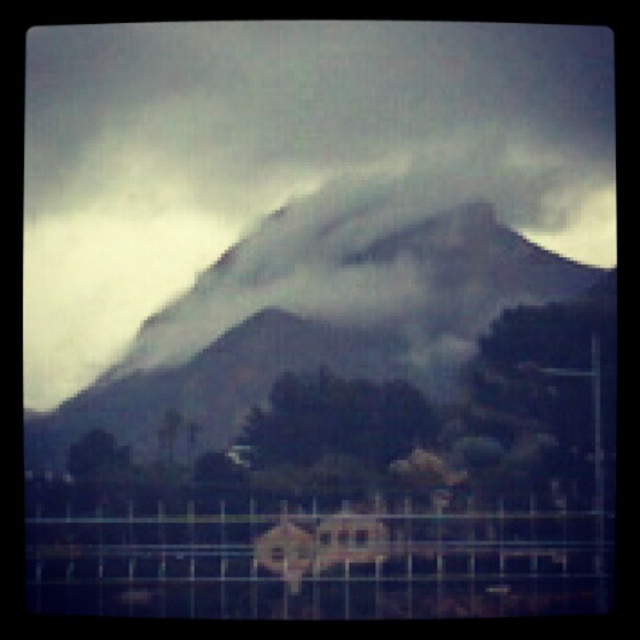
Question: Which point is closer to the camera?

Choices:
 (A) (120, 509)
 (B) (381, 300)

Answer: (A)

Question: Is foggy gray mountain at center closer to the viewer compared to metallic wire fence at lower center?

Choices:
 (A) no
 (B) yes

Answer: (A)

Question: Is foggy gray mountain at center bigger than metallic wire fence at lower center?

Choices:
 (A) yes
 (B) no

Answer: (A)

Question: Is foggy gray mountain at center smaller than metallic wire fence at lower center?

Choices:
 (A) yes
 (B) no

Answer: (B)